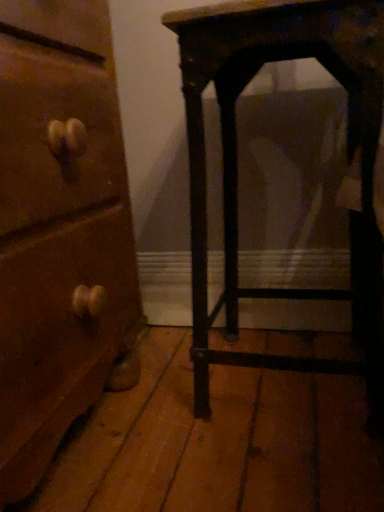
Locate an element on the screen. The image size is (384, 512). vacant space underneath dark wood table at right (from a real-world perspective) is located at coordinates (295, 381).